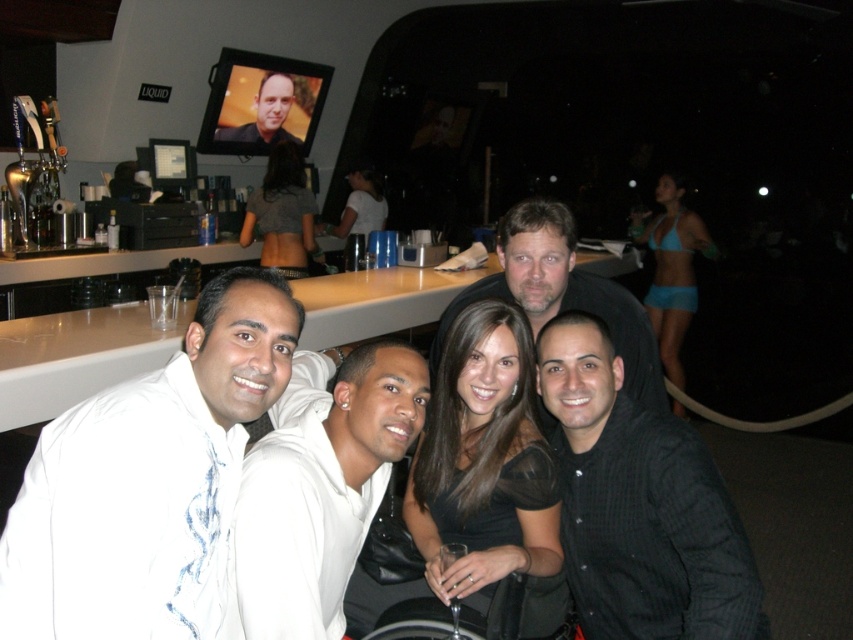
Between teal bikini top at upper right and matte black dress at center, which one appears on the left side from the viewer's perspective?

matte black dress at center is more to the left.

What do you see at coordinates (671, 269) in the screenshot? The height and width of the screenshot is (640, 853). I see `teal bikini top at upper right` at bounding box center [671, 269].

Image resolution: width=853 pixels, height=640 pixels. What do you see at coordinates (671, 269) in the screenshot? I see `teal bikini top at upper right` at bounding box center [671, 269].

You are a GUI agent. You are given a task and a screenshot of the screen. Output one action in this format:
    pyautogui.click(x=<x>, y=<y>)
    Task: Click on the teal bikini top at upper right
    The width and height of the screenshot is (853, 640).
    Given the screenshot: What is the action you would take?
    pyautogui.click(x=671, y=269)

The width and height of the screenshot is (853, 640). Find the location of `white matte hoodie at center`. white matte hoodie at center is located at coordinates (318, 488).

Does point (390, 412) come in front of point (643, 323)?

Yes, it is in front of point (643, 323).

Does point (302, 568) come closer to viewer compared to point (634, 339)?

Yes, it is.

Identify the location of white matte hoodie at center. (318, 488).

Between matte black shirt at center and matte black dress at center, which one has more height?

matte black dress at center

Does matte black shirt at center have a larger size compared to matte black dress at center?

No, matte black shirt at center is not bigger than matte black dress at center.

Describe the element at coordinates (265, 113) in the screenshot. I see `matte black shirt at center` at that location.

This screenshot has height=640, width=853. What are the coordinates of `matte black shirt at center` in the screenshot? It's located at (265, 113).